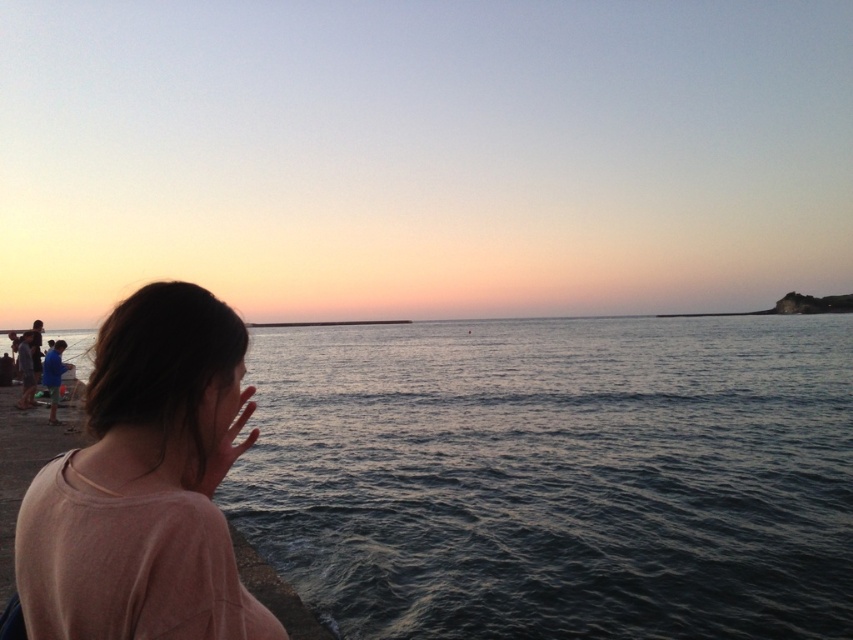
Can you confirm if smooth water at center is shorter than pink cotton shirt at lower left?

Incorrect, smooth water at center's height does not fall short of pink cotton shirt at lower left's.

Which is in front, point (366, 358) or point (48, 529)?

Point (48, 529) is more forward.

What are the coordinates of `smooth water at center` in the screenshot? It's located at (556, 476).